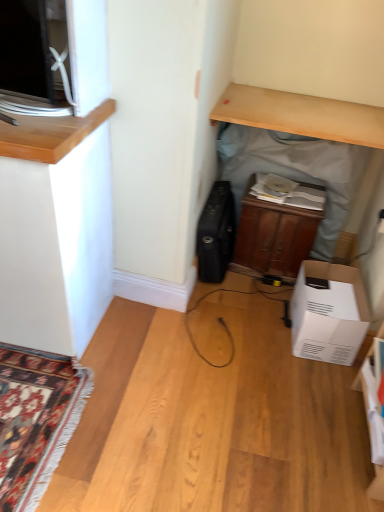
Question: Can wooden cabinet at center be found inside white cardboard box at lower right?

Choices:
 (A) no
 (B) yes

Answer: (A)

Question: Considering the relative positions of white cardboard box at lower right and wooden cabinet at center in the image provided, is white cardboard box at lower right to the right of wooden cabinet at center from the viewer's perspective?

Choices:
 (A) no
 (B) yes

Answer: (B)

Question: From a real-world perspective, is white cardboard box at lower right positioned under wooden cabinet at center based on gravity?

Choices:
 (A) yes
 (B) no

Answer: (A)

Question: Could you tell me if white cardboard box at lower right is turned towards wooden cabinet at center?

Choices:
 (A) no
 (B) yes

Answer: (A)

Question: Is white cardboard box at lower right far away from wooden cabinet at center?

Choices:
 (A) yes
 (B) no

Answer: (B)

Question: Is point (306, 113) closer or farther from the camera than point (198, 227)?

Choices:
 (A) farther
 (B) closer

Answer: (B)

Question: In terms of width, does wooden cabinet at center look wider or thinner when compared to black matte suitcase at center?

Choices:
 (A) wide
 (B) thin

Answer: (B)

Question: Would you say wooden cabinet at center is inside or outside black matte suitcase at center?

Choices:
 (A) outside
 (B) inside

Answer: (A)

Question: Is wooden cabinet at center in front of or behind black matte suitcase at center in the image?

Choices:
 (A) behind
 (B) front

Answer: (B)

Question: Relative to light wood desk at upper center, is white cardboard box at lower right in front or behind?

Choices:
 (A) behind
 (B) front

Answer: (A)

Question: Is white cardboard box at lower right bigger or smaller than light wood desk at upper center?

Choices:
 (A) small
 (B) big

Answer: (B)

Question: From the image's perspective, is white cardboard box at lower right positioned above or below light wood desk at upper center?

Choices:
 (A) above
 (B) below

Answer: (B)

Question: In terms of height, does white cardboard box at lower right look taller or shorter compared to light wood desk at upper center?

Choices:
 (A) tall
 (B) short

Answer: (A)

Question: From the image's perspective, is light wood desk at upper center positioned above or below white cardboard box at lower right?

Choices:
 (A) below
 (B) above

Answer: (B)

Question: Based on their sizes in the image, would you say light wood desk at upper center is bigger or smaller than white cardboard box at lower right?

Choices:
 (A) big
 (B) small

Answer: (B)